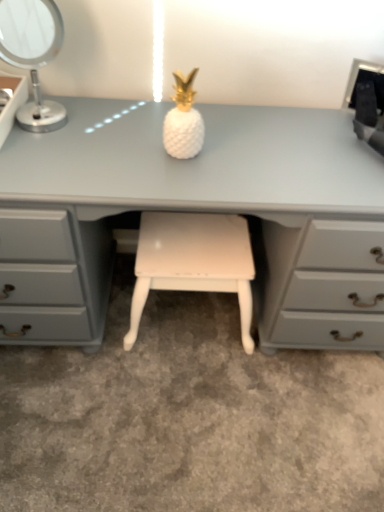
Where is `vacant area that is in front of matte white desk at center`? vacant area that is in front of matte white desk at center is located at coordinates (176, 430).